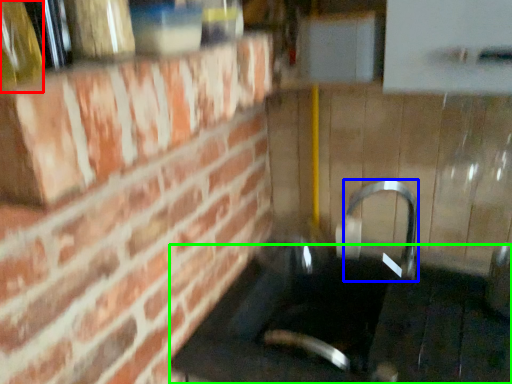
Question: Which is nearer to the bottle (highlighted by a red box)? faucet (highlighted by a blue box) or counter top (highlighted by a green box).

Choices:
 (A) faucet
 (B) counter top

Answer: (B)